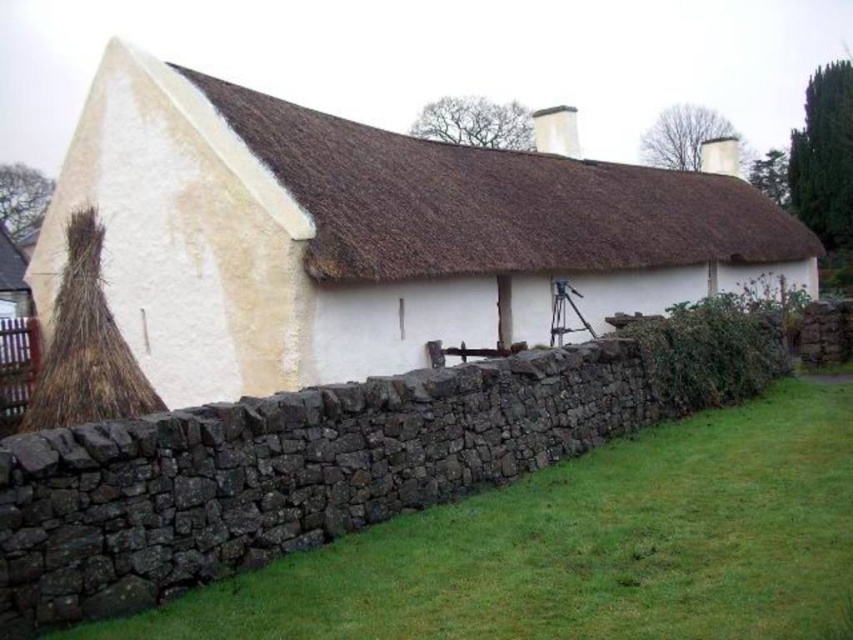
Question: Which object is the farthest from the green grass at lower right?

Choices:
 (A) brown thatch roof at center
 (B) white stucco cottage at center

Answer: (A)

Question: In this image, where is green grass at lower right located relative to brown thatch roof at center?

Choices:
 (A) below
 (B) above

Answer: (A)

Question: Does white stucco cottage at center come in front of brown thatch roof at center?

Choices:
 (A) no
 (B) yes

Answer: (A)

Question: Which point appears farthest from the camera in this image?

Choices:
 (A) (401, 209)
 (B) (631, 234)

Answer: (B)

Question: Which point is closer to the camera?

Choices:
 (A) white stucco cottage at center
 (B) green grass at lower right

Answer: (B)

Question: Can you confirm if white stucco cottage at center is smaller than green grass at lower right?

Choices:
 (A) no
 (B) yes

Answer: (A)